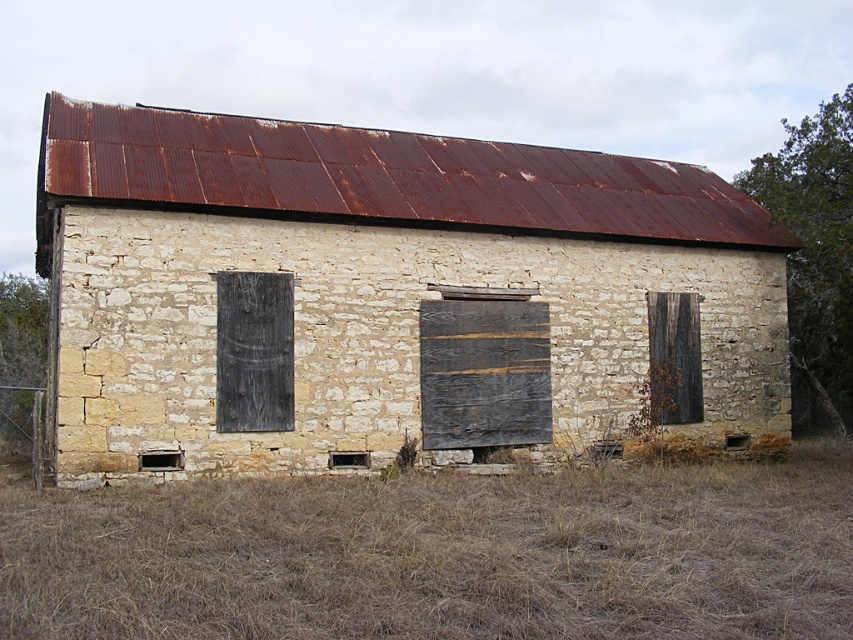
Can you confirm if brown grass at lower center is smaller than weathered wood door at center?

Incorrect, brown grass at lower center is not smaller in size than weathered wood door at center.

Identify the location of brown grass at lower center. This screenshot has width=853, height=640. (440, 554).

Who is positioned more to the left, rusty corrugated metal roof at upper center or dark brown wooden door at right?

From the viewer's perspective, rusty corrugated metal roof at upper center appears more on the left side.

Can you confirm if rusty corrugated metal roof at upper center is shorter than dark brown wooden door at right?

In fact, rusty corrugated metal roof at upper center may be taller than dark brown wooden door at right.

At what (x,y) coordinates should I click in order to perform the action: click on rusty corrugated metal roof at upper center. Please return your answer as a coordinate pair (x, y). Looking at the image, I should click on (386, 289).

Image resolution: width=853 pixels, height=640 pixels. Find the location of `rusty corrugated metal roof at upper center`. rusty corrugated metal roof at upper center is located at coordinates (386, 289).

Can you confirm if dark gray wood shutter at center left is shorter than dark brown wooden door at right?

Yes, dark gray wood shutter at center left is shorter than dark brown wooden door at right.

You are a GUI agent. You are given a task and a screenshot of the screen. Output one action in this format:
    pyautogui.click(x=<x>, y=<y>)
    Task: Click on the dark gray wood shutter at center left
    This screenshot has height=640, width=853.
    Given the screenshot: What is the action you would take?
    pyautogui.click(x=254, y=352)

The height and width of the screenshot is (640, 853). I want to click on dark gray wood shutter at center left, so tap(254, 352).